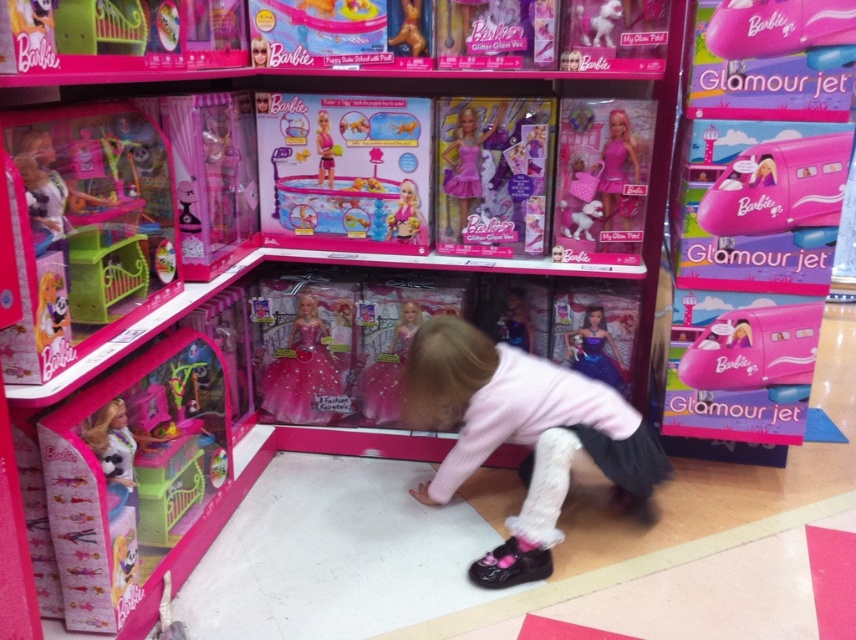
You are a parent trying to decide whether to buy the pink fabric skirt at center and the matte green plastic crib at upper left for your child. The shelf where the crib is placed can only hold items up to the width of the crib. Can you place both items on the same shelf?

Answer: The pink fabric skirt at center is wider than the matte green plastic crib at upper left, so it cannot fit on the shelf designed for the crib since the shelf can only accommodate items up to the crib width.

From the picture: You are a parent helping your child choose a Barbie doll. You see two dolls in the store display. The first is the pink plastic doll at center, and the second is the pink plastic doll at upper center. Which doll is located lower on the shelf?

The pink plastic doll at center is positioned under the pink plastic doll at upper center, so the pink plastic doll at center is lower on the shelf.

What is the object located at the coordinates point (x=524, y=436) in the image?

The point (x=524, y=436) is on the pink fabric skirt at center.